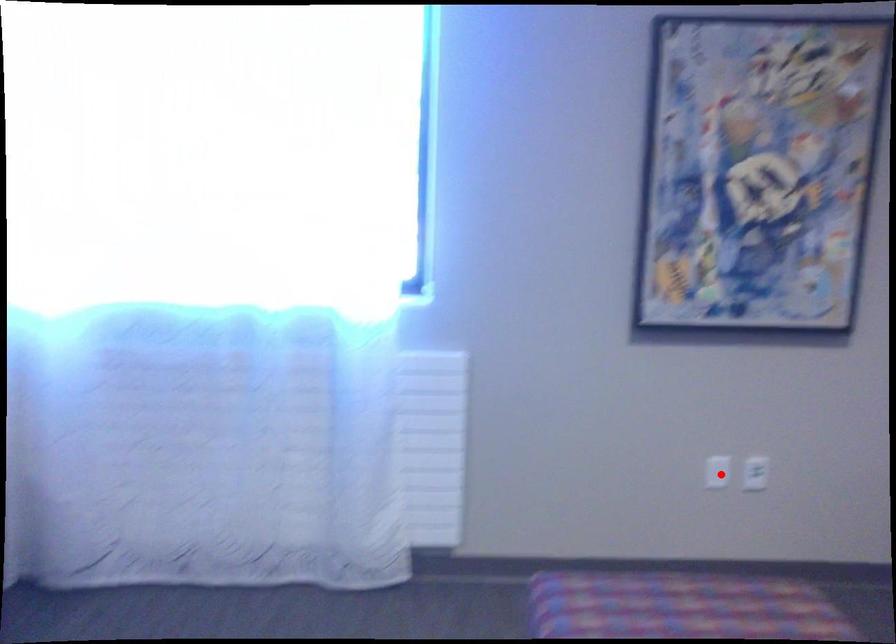
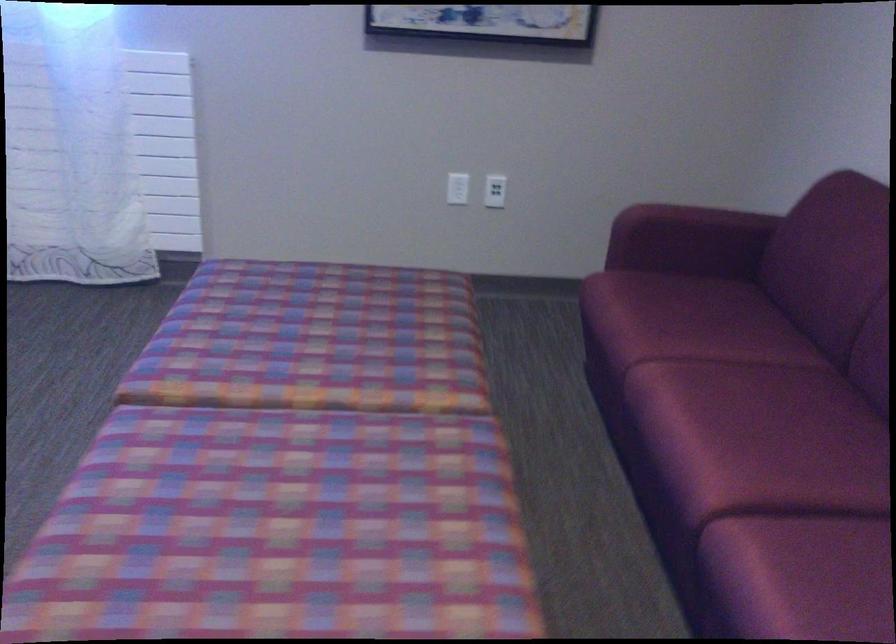
Locate, in the second image, the point that corresponds to the highlighted location in the first image.

(458, 187)